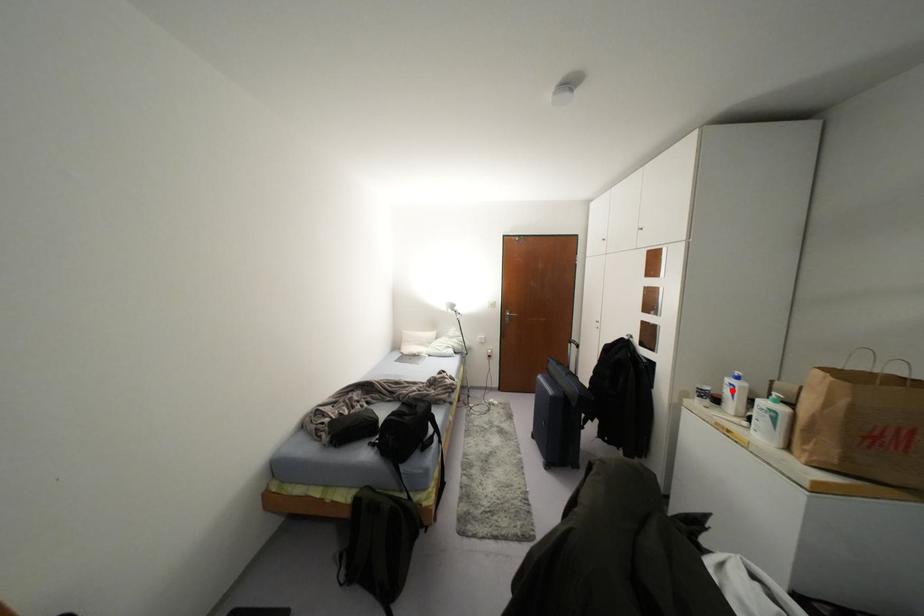
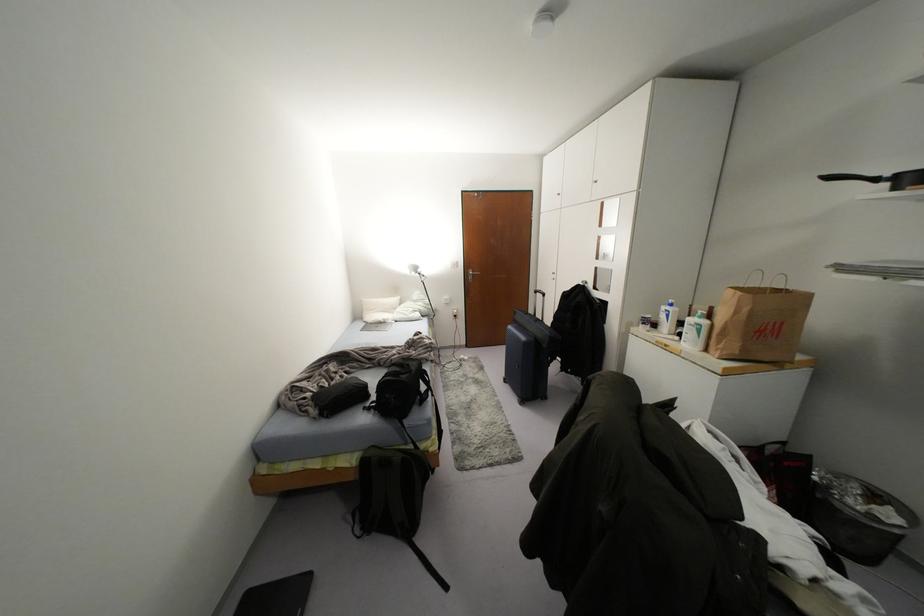
Find the pixel in the second image that matches the highlighted location in the first image.

(666, 315)